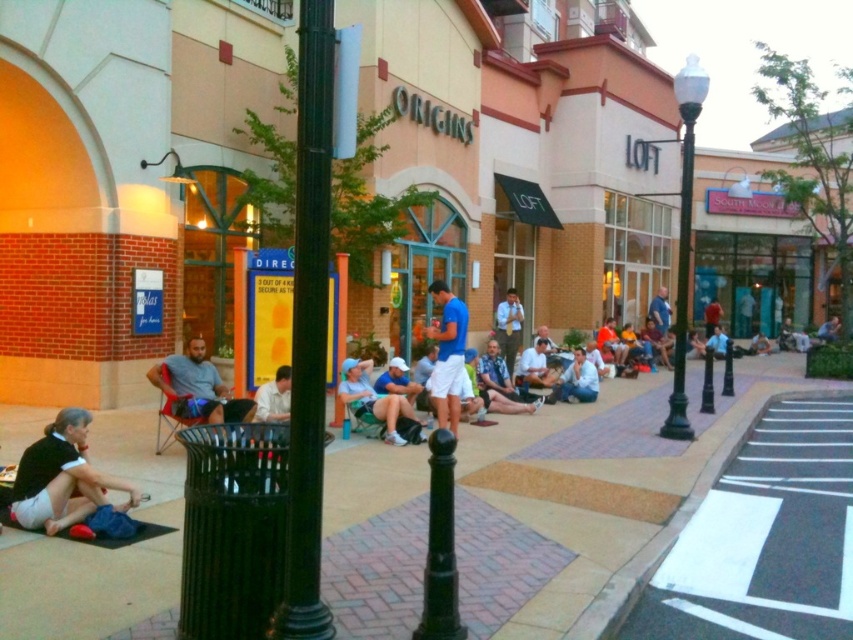
Question: Which point is farther to the camera?

Choices:
 (A) (573, 349)
 (B) (196, 360)
 (C) (317, 45)

Answer: (A)

Question: Is black metal pole at center below light blue shirt at lower center?

Choices:
 (A) no
 (B) yes

Answer: (B)

Question: Which of these objects is positioned farthest from the light blue shirt at center?

Choices:
 (A) gray fabric chair at lower left
 (B) black metal pole at center

Answer: (B)

Question: Is green metallic pole at center wider than black metal pole at center?

Choices:
 (A) no
 (B) yes

Answer: (B)

Question: Which of the following is the farthest from the observer?

Choices:
 (A) (509, 289)
 (B) (399, 444)

Answer: (A)

Question: Can you confirm if matte brick mall at center is bigger than light blue shirt at lower center?

Choices:
 (A) no
 (B) yes

Answer: (B)